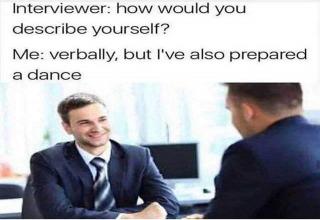
Locate an element on the screen. This screenshot has height=220, width=320. white table is located at coordinates (5, 203).